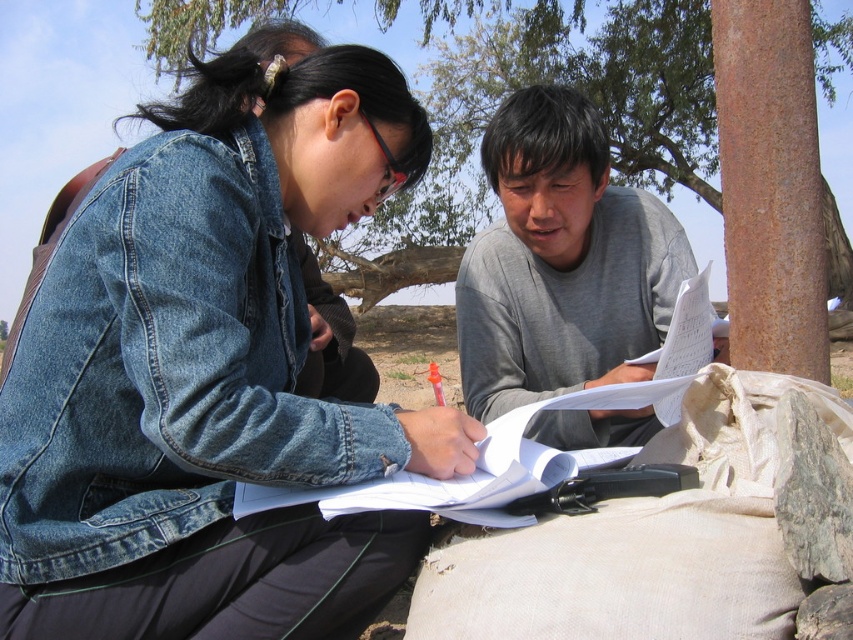
Question: Does gray cotton shirt at center have a smaller size compared to brown rough tree at upper center?

Choices:
 (A) yes
 (B) no

Answer: (A)

Question: Can you confirm if gray cotton shirt at center is smaller than brown rough tree at upper center?

Choices:
 (A) yes
 (B) no

Answer: (A)

Question: Which object is the closest to the gray cotton shirt at center?

Choices:
 (A) denim jacket at upper left
 (B) brown rough tree at upper center

Answer: (A)

Question: Which of the following is the farthest from the observer?

Choices:
 (A) (639, 52)
 (B) (236, 186)

Answer: (A)

Question: Which object appears farthest from the camera in this image?

Choices:
 (A) brown rough tree at upper center
 (B) denim jacket at upper left

Answer: (A)

Question: Is gray cotton shirt at center below brown rough tree at upper center?

Choices:
 (A) no
 (B) yes

Answer: (B)